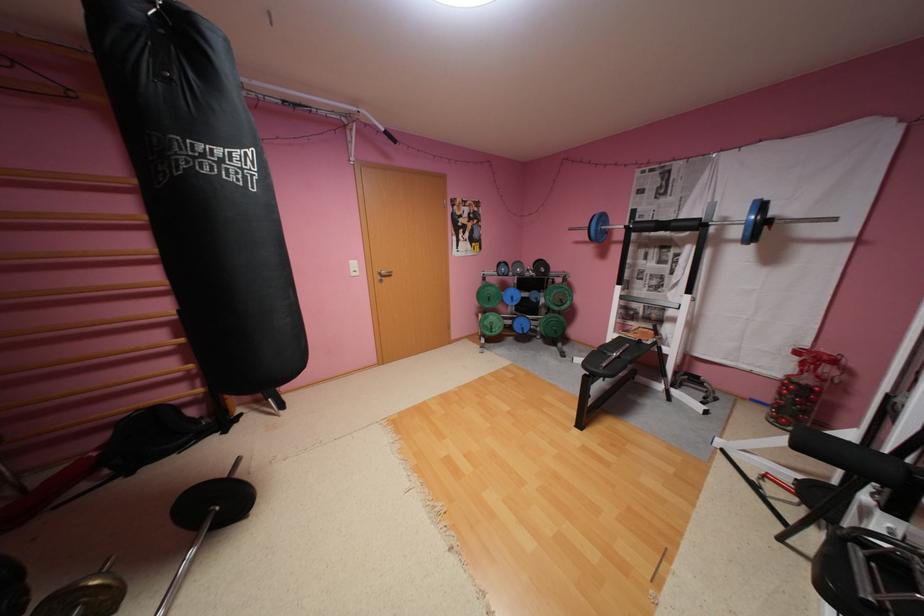
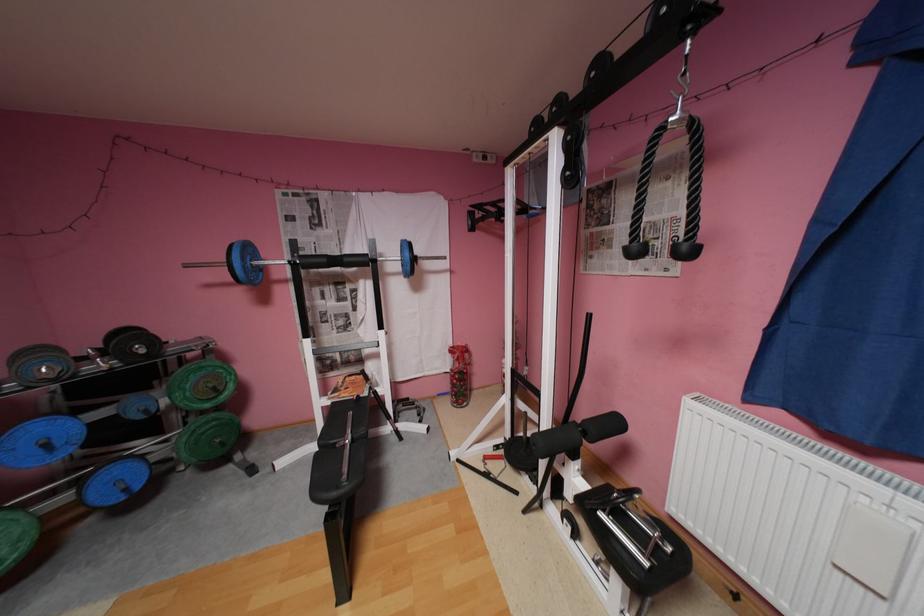
The point at (683, 224) is marked in the first image. Where is the corresponding point in the second image?

(355, 259)